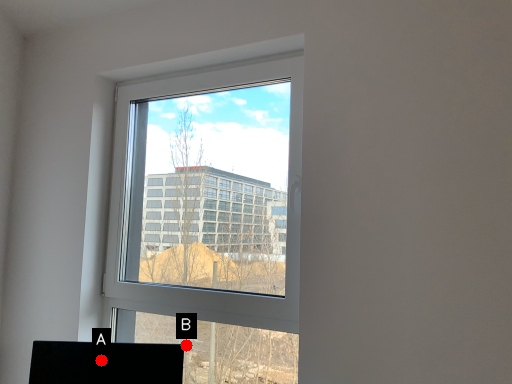
Question: Two points are circled on the image, labeled by A and B beside each circle. Which point appears farthest from the camera in this image?

Choices:
 (A) A is further
 (B) B is further

Answer: (B)